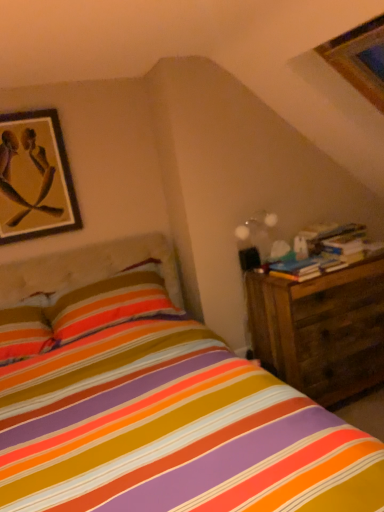
Where is `wooden framed artwork at upper left`? The width and height of the screenshot is (384, 512). wooden framed artwork at upper left is located at coordinates (35, 178).

Considering the sizes of objects translucent glass globe at upper right and wooden nightstand at right in the image provided, who is shorter, translucent glass globe at upper right or wooden nightstand at right?

translucent glass globe at upper right is shorter.

Considering the relative positions of translucent glass globe at upper right and wooden nightstand at right in the image provided, is translucent glass globe at upper right to the right of wooden nightstand at right from the viewer's perspective?

In fact, translucent glass globe at upper right is to the left of wooden nightstand at right.

Does translucent glass globe at upper right have a greater width compared to wooden nightstand at right?

Incorrect, the width of translucent glass globe at upper right does not surpass that of wooden nightstand at right.

From the image's perspective, relative to translucent glass globe at upper right, is wooden nightstand at right above or below?

Based on their image positions, wooden nightstand at right is located beneath translucent glass globe at upper right.

Which of these two, wooden nightstand at right or translucent glass globe at upper right, is thinner?

With smaller width is translucent glass globe at upper right.

Does wooden nightstand at right contain translucent glass globe at upper right?

That's incorrect, translucent glass globe at upper right is not inside wooden nightstand at right.

Considering the sizes of objects wooden nightstand at right and translucent glass globe at upper right in the image provided, who is bigger, wooden nightstand at right or translucent glass globe at upper right?

wooden nightstand at right is bigger.

Considering the sizes of wooden framed artwork at upper left and translucent glass globe at upper right in the image, is wooden framed artwork at upper left wider or thinner than translucent glass globe at upper right?

In the image, wooden framed artwork at upper left appears to be more narrow than translucent glass globe at upper right.

Looking at this image, how distant is wooden framed artwork at upper left from translucent glass globe at upper right?

wooden framed artwork at upper left and translucent glass globe at upper right are 1.19 meters apart from each other.

Is wooden framed artwork at upper left facing away from translucent glass globe at upper right?

That's not correct — wooden framed artwork at upper left is not looking away from translucent glass globe at upper right.

In the scene shown: From their relative heights in the image, would you say wooden framed artwork at upper left is taller or shorter than translucent glass globe at upper right?

wooden framed artwork at upper left is taller than translucent glass globe at upper right.

Choose the correct answer: Is wooden framed artwork at upper left inside wooden nightstand at right or outside it?

wooden framed artwork at upper left is spatially situated outside wooden nightstand at right.

Can you confirm if wooden framed artwork at upper left is positioned to the left of wooden nightstand at right?

Correct, you'll find wooden framed artwork at upper left to the left of wooden nightstand at right.

In terms of size, does wooden framed artwork at upper left appear bigger or smaller than wooden nightstand at right?

Clearly, wooden framed artwork at upper left is smaller in size than wooden nightstand at right.

Which object is closer to the camera, wooden framed artwork at upper left or wooden nightstand at right?

wooden nightstand at right is closer to the camera.

Would you consider wooden nightstand at right to be distant from wooden framed artwork at upper left?

wooden nightstand at right is far away from wooden framed artwork at upper left.

Is wooden nightstand at right smaller than wooden framed artwork at upper left?

Actually, wooden nightstand at right might be larger than wooden framed artwork at upper left.

Who is taller, wooden nightstand at right or wooden framed artwork at upper left?

With more height is wooden nightstand at right.

Would you say wooden nightstand at right contains wooden framed artwork at upper left?

That's incorrect, wooden framed artwork at upper left is not inside wooden nightstand at right.

Is translucent glass globe at upper right positioned far away from wooden framed artwork at upper left?

Yes, translucent glass globe at upper right and wooden framed artwork at upper left are located far from each other.

Is translucent glass globe at upper right further to the viewer compared to wooden framed artwork at upper left?

Yes, translucent glass globe at upper right is further from the viewer.

Would you say wooden framed artwork at upper left is part of translucent glass globe at upper right's contents?

No.

Which is in front, point (254, 258) or point (43, 194)?

Point (43, 194)

The image size is (384, 512). In the image, there is a wooden nightstand at right. Identify the location of light fixture above it (from the image's perspective). (254, 238).

Image resolution: width=384 pixels, height=512 pixels. I want to click on nightstand beneath the translucent glass globe at upper right (from a real-world perspective), so click(321, 329).

Estimate the real-world distances between objects in this image. Which object is closer to translucent glass globe at upper right, wooden framed artwork at upper left or wooden nightstand at right?

Among the two, wooden nightstand at right is located nearer to translucent glass globe at upper right.

When comparing their distances from translucent glass globe at upper right, does wooden nightstand at right or wooden framed artwork at upper left seem closer?

wooden nightstand at right is positioned closer to the anchor translucent glass globe at upper right.

From the picture: When comparing their distances from wooden framed artwork at upper left, does wooden nightstand at right or translucent glass globe at upper right seem further?

wooden nightstand at right.

Based on their spatial positions, is wooden framed artwork at upper left or translucent glass globe at upper right closer to wooden nightstand at right?

translucent glass globe at upper right is positioned closer to the anchor wooden nightstand at right.

Based on their spatial positions, is translucent glass globe at upper right or wooden nightstand at right further from wooden framed artwork at upper left?

Among the two, wooden nightstand at right is located further to wooden framed artwork at upper left.

Based on their spatial positions, is translucent glass globe at upper right or wooden framed artwork at upper left further from wooden nightstand at right?

Among the two, wooden framed artwork at upper left is located further to wooden nightstand at right.

At what (x,y) coordinates should I click in order to perform the action: click on light fixture located between wooden framed artwork at upper left and wooden nightstand at right in the left-right direction. Please return your answer as a coordinate pair (x, y). The height and width of the screenshot is (512, 384). Looking at the image, I should click on (254, 238).